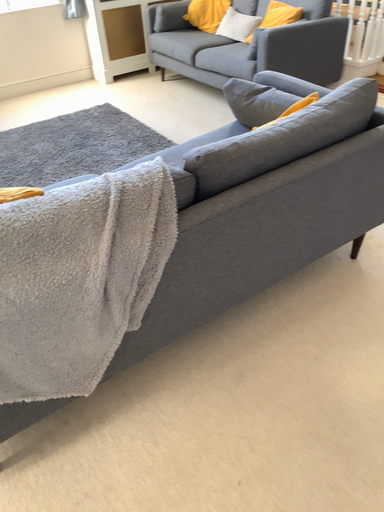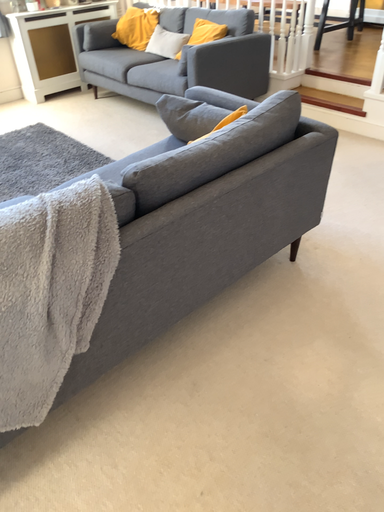
Question: Which way did the camera rotate in the video?

Choices:
 (A) rotated right
 (B) rotated left

Answer: (A)